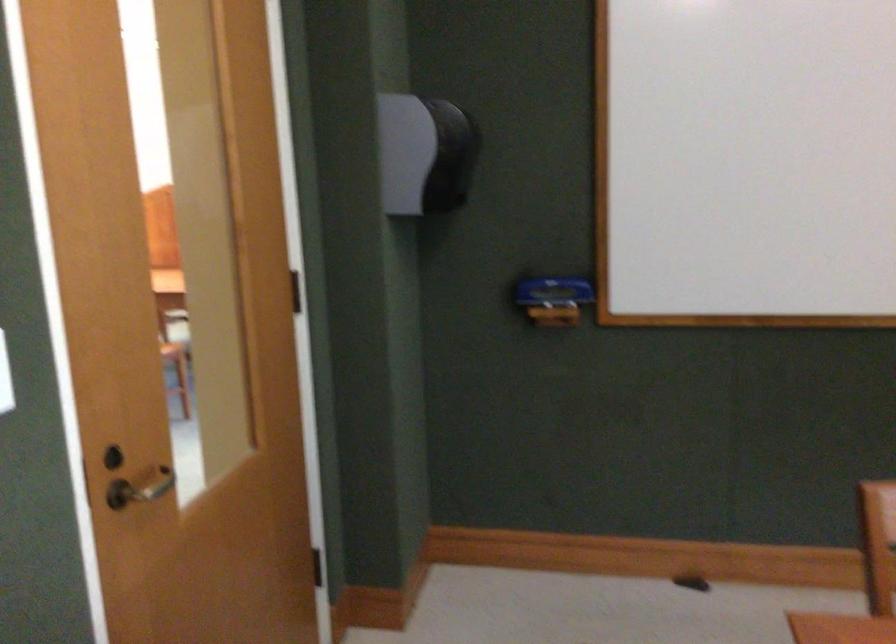
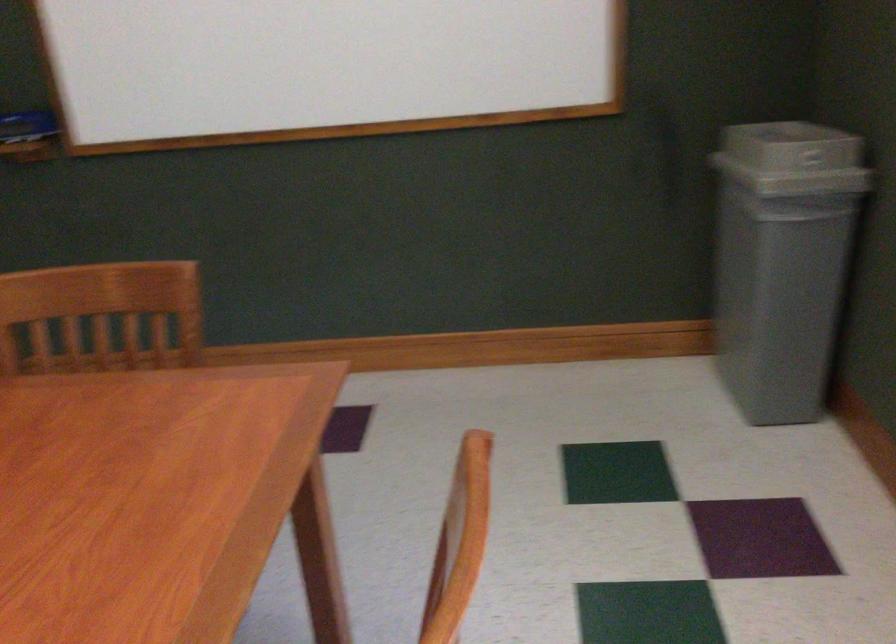
Question: The images are taken continuously from a first-person perspective. In which direction are you moving?

Choices:
 (A) Left
 (B) Right
 (C) Forward
 (D) Backward

Answer: (B)